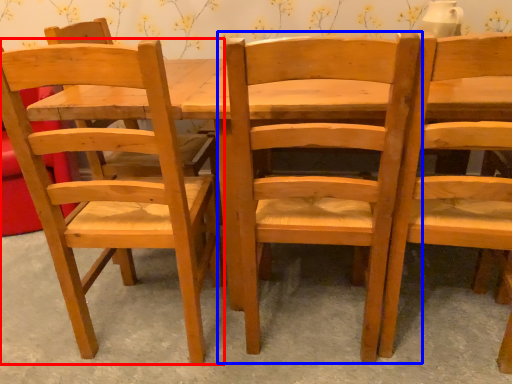
Question: Which object appears closest to the camera in this image, chair (highlighted by a red box) or chair (highlighted by a blue box)?

Choices:
 (A) chair
 (B) chair

Answer: (B)